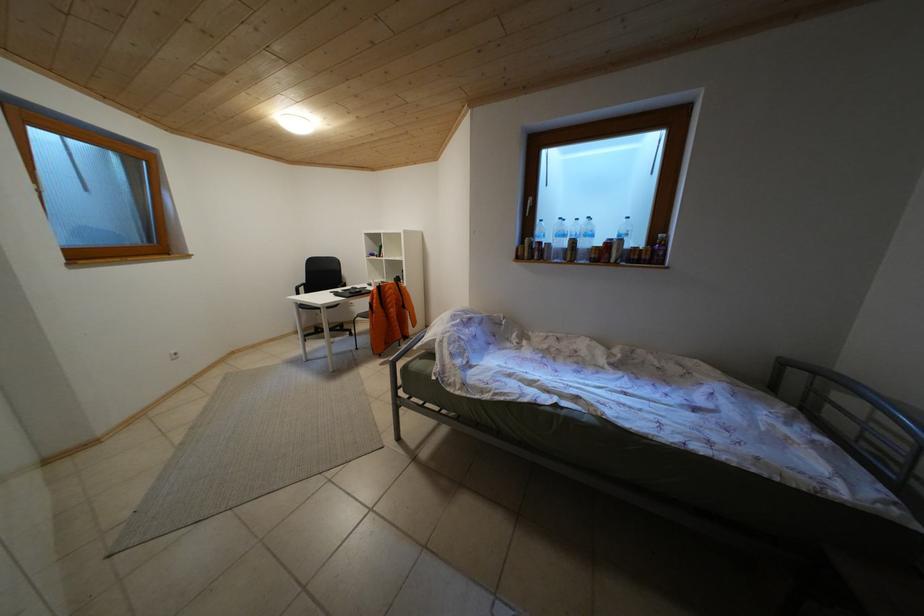
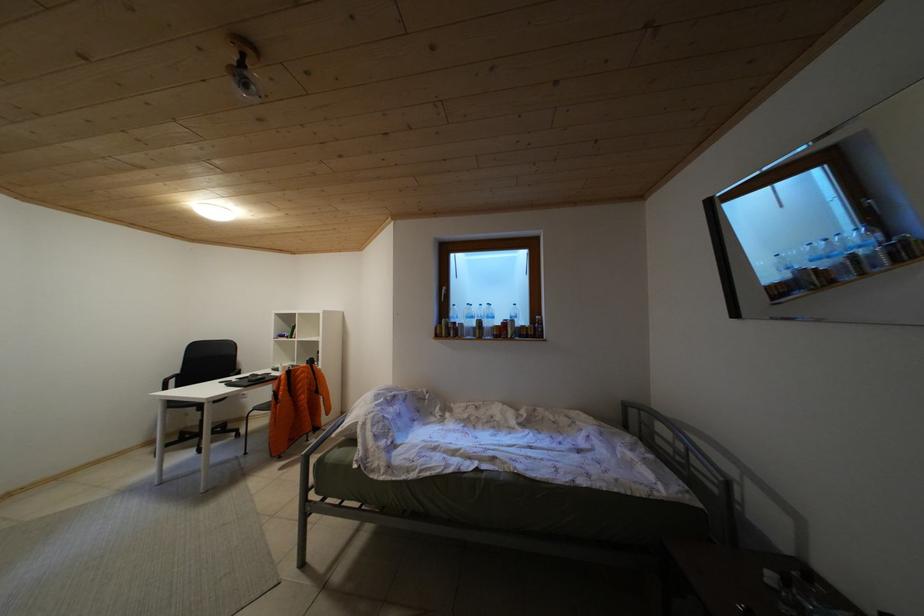
The first image is from the beginning of the video and the second image is from the end. How did the camera likely rotate when shooting the video?

The camera rotated toward right-up.